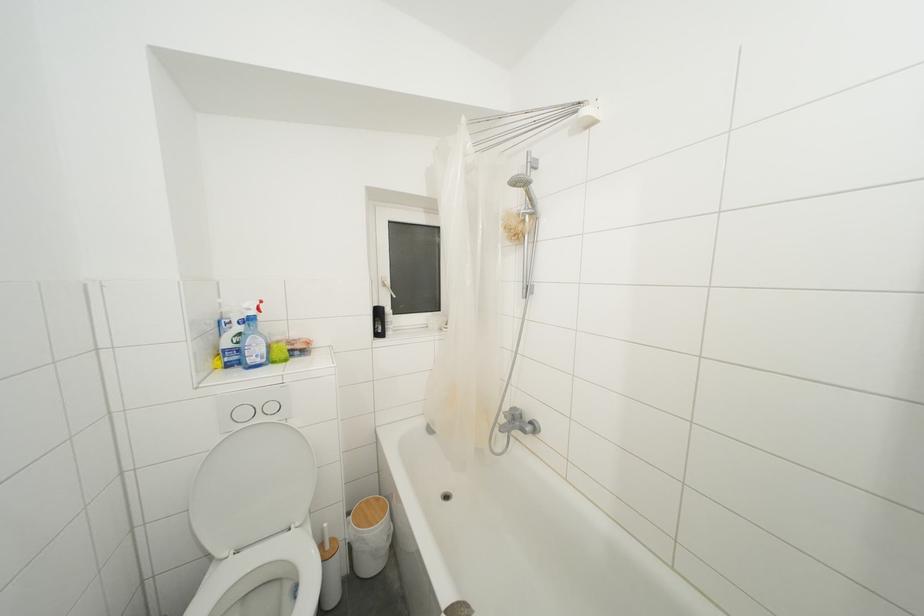
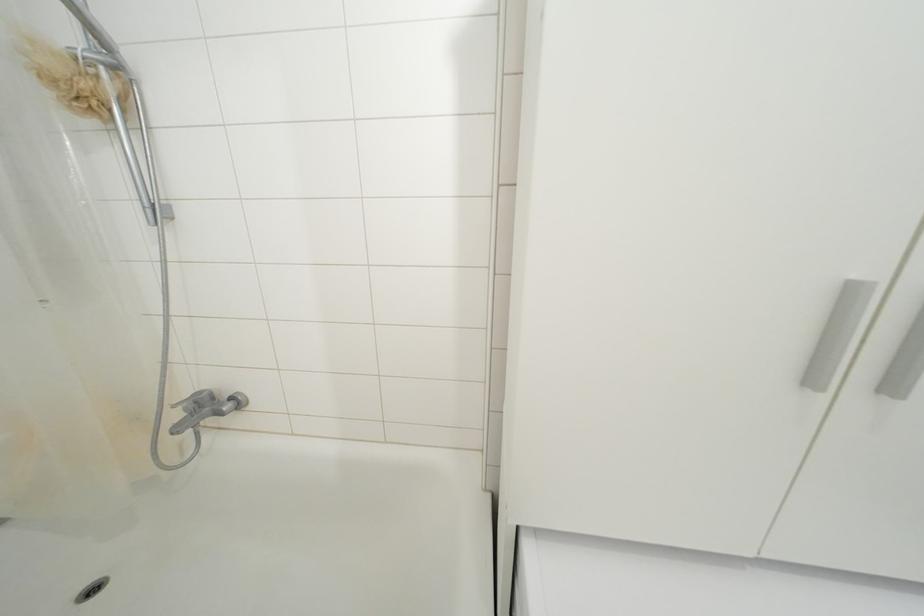
Find the pixel in the second image that matches [528,225] in the first image.

(100, 79)